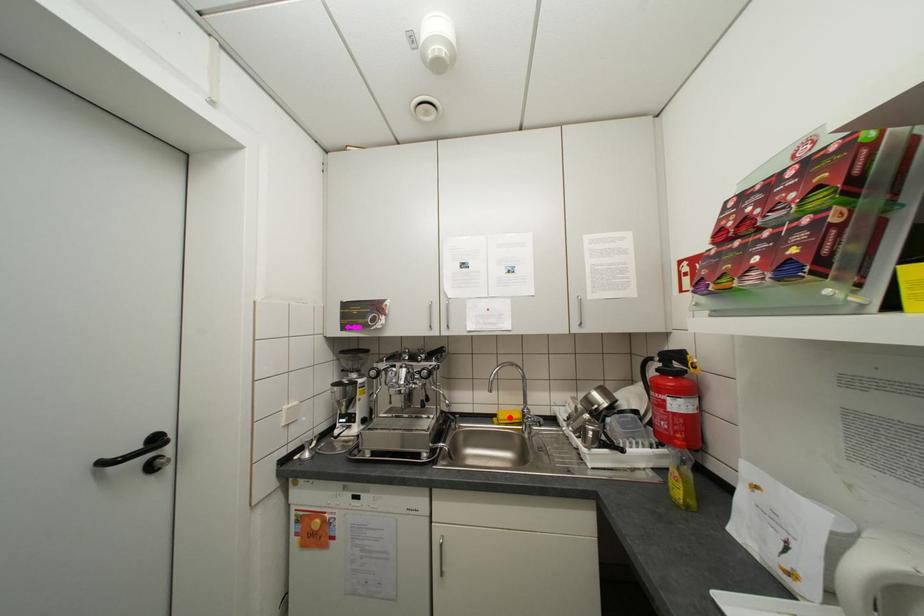
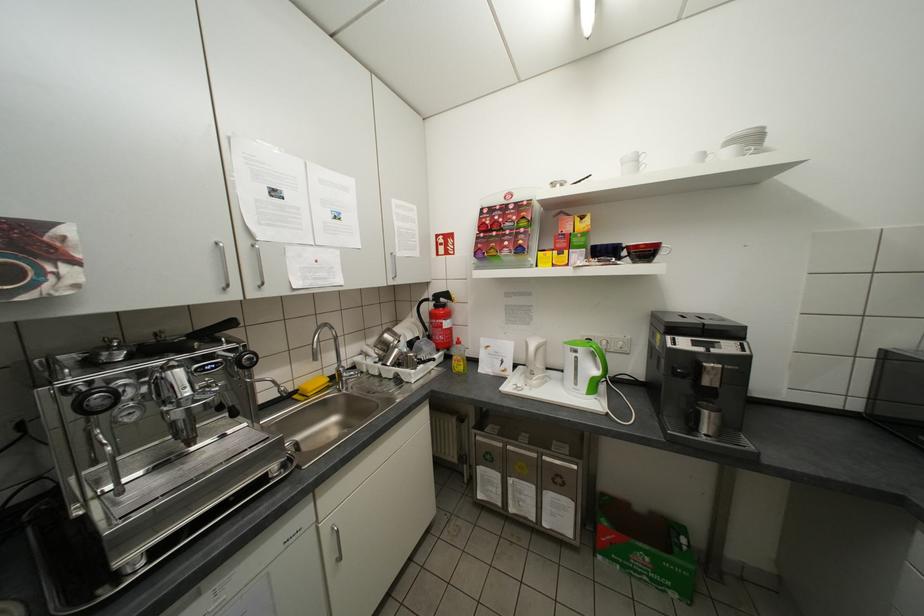
Question: A red point is marked in image1. In image2, is the corresponding 3D point closer to the camera or farther? Reply with the corresponding letter.

Choices:
 (A) The corresponding 3D point is closer.
 (B) The corresponding 3D point is farther.

Answer: (A)